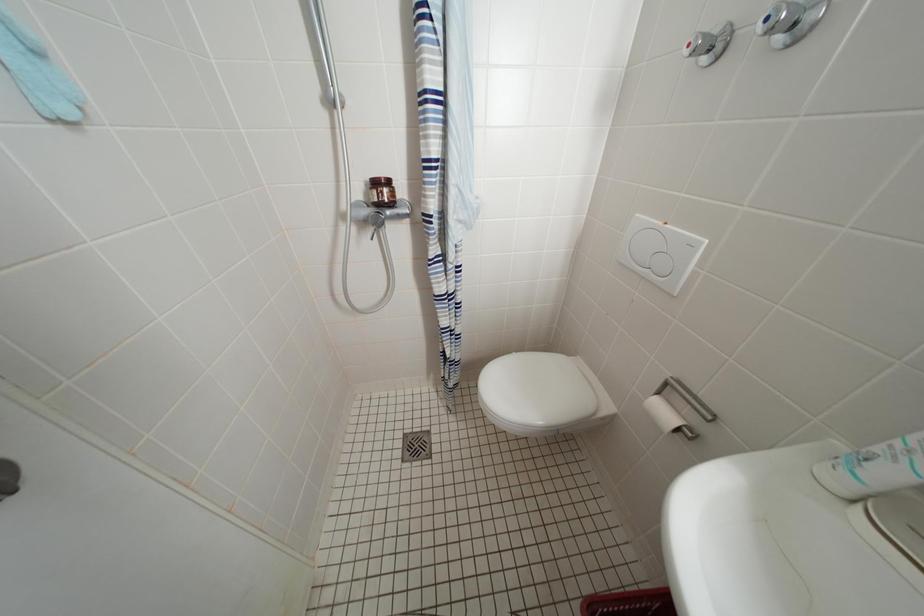
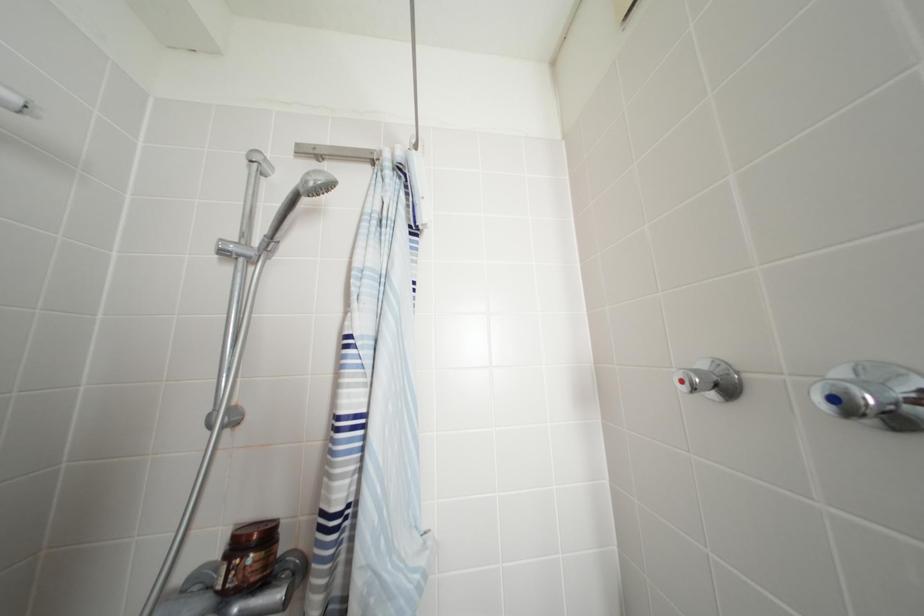
Question: The images are taken continuously from a first-person perspective. In which direction is your viewpoint rotating?

Choices:
 (A) Left
 (B) Right
 (C) Up
 (D) Down

Answer: (C)